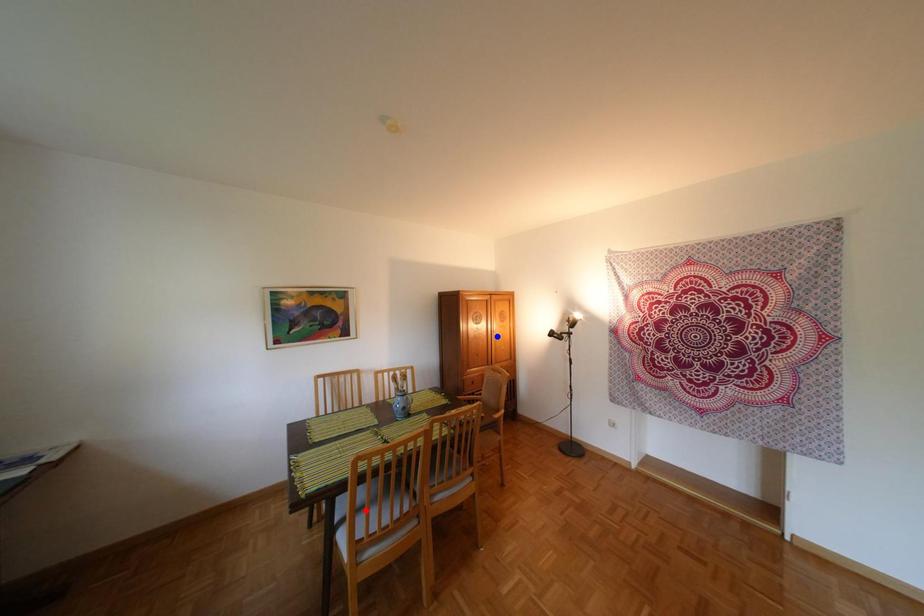
Question: In the image, two points are highlighted. Which point is nearer to the camera? Reply with the corresponding letter.

Choices:
 (A) blue point
 (B) red point

Answer: (B)